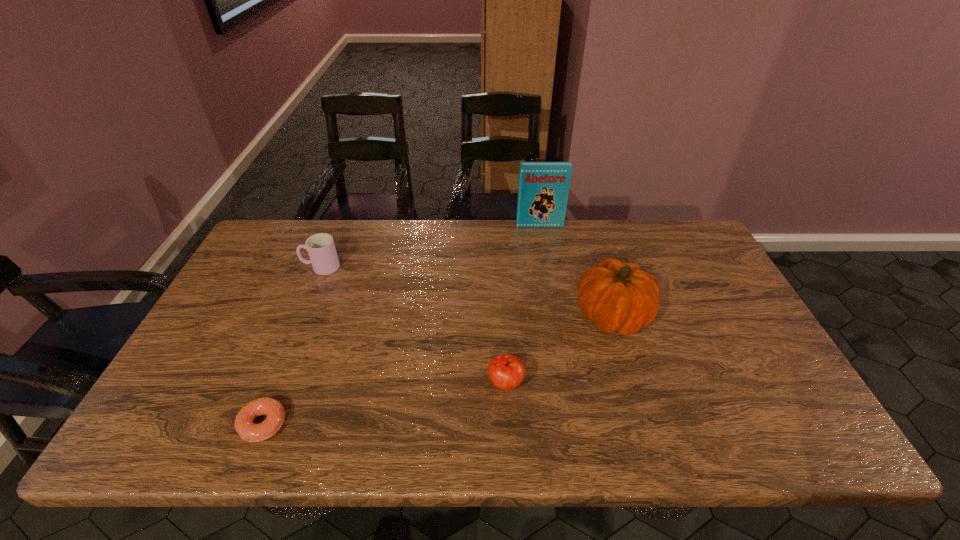
The image size is (960, 540). I want to click on the farthest object, so click(543, 188).

Where is `the tallest object`? This screenshot has height=540, width=960. the tallest object is located at coordinates (543, 188).

Identify the location of pumpkin. (617, 296).

This screenshot has height=540, width=960. I want to click on the third farthest object, so click(x=617, y=296).

Locate an element on the screen. the second farthest object is located at coordinates (321, 248).

Locate an element on the screen. This screenshot has height=540, width=960. apple is located at coordinates (506, 372).

Find the location of `the fourth farthest object`. the fourth farthest object is located at coordinates (506, 372).

You are a GUI agent. You are given a task and a screenshot of the screen. Output one action in this format:
    pyautogui.click(x=<x>, y=<y>)
    Task: Click on the nearest object
    The width and height of the screenshot is (960, 540).
    Given the screenshot: What is the action you would take?
    pyautogui.click(x=247, y=430)

Find the location of `the shortest object`. the shortest object is located at coordinates (247, 430).

Identify the location of vacant space located 0.130m on the front cover of the book. Image resolution: width=960 pixels, height=540 pixels. (544, 251).